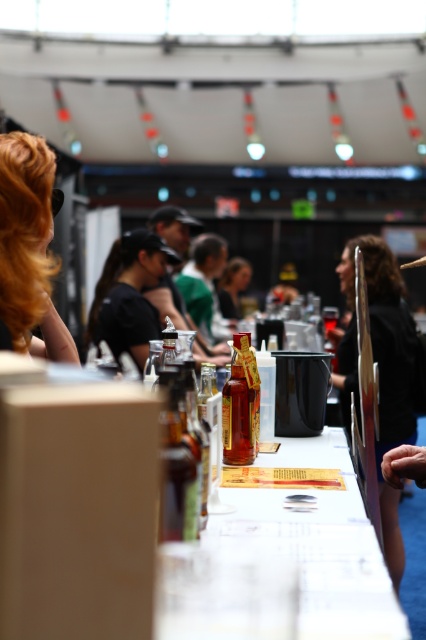
Does blonde hair at upper left have a lesser width compared to black fabric shirt at right?

Indeed, blonde hair at upper left has a lesser width compared to black fabric shirt at right.

Between blonde hair at upper left and black fabric shirt at right, which one is positioned higher?

blonde hair at upper left

Measure the distance between point [17,132] and camera.

The distance of point [17,132] from camera is 1.71 meters.

This screenshot has width=426, height=640. In order to click on blonde hair at upper left in this screenshot , I will do `click(28, 250)`.

Is black fabric shirt at right below translucent glass bottle at center?

Correct, black fabric shirt at right is located below translucent glass bottle at center.

You are a GUI agent. You are given a task and a screenshot of the screen. Output one action in this format:
    pyautogui.click(x=<x>, y=<y>)
    Task: Click on the black fabric shirt at right
    This screenshot has height=640, width=426.
    Given the screenshot: What is the action you would take?
    pyautogui.click(x=386, y=371)

Describe the element at coordinates (28, 250) in the screenshot. This screenshot has width=426, height=640. I see `blonde hair at upper left` at that location.

Which of these two, blonde hair at upper left or matte black hair at center, stands shorter?

With less height is blonde hair at upper left.

Measure the distance between point [25,176] and camera.

The distance of point [25,176] from camera is 1.60 meters.

The width and height of the screenshot is (426, 640). I want to click on blonde hair at upper left, so click(x=28, y=250).